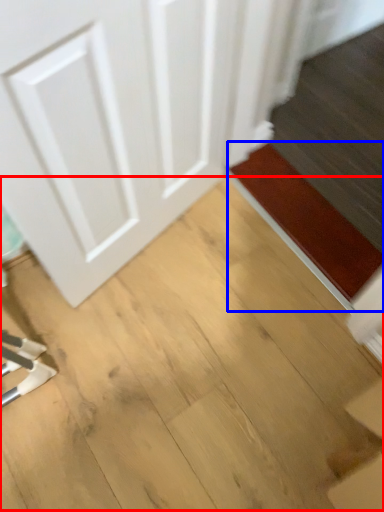
Question: Which object appears farthest to the camera in this image, plywood (highlighted by a red box) or doormat (highlighted by a blue box)?

Choices:
 (A) plywood
 (B) doormat

Answer: (B)